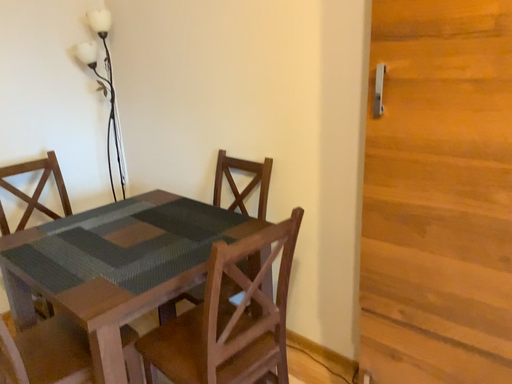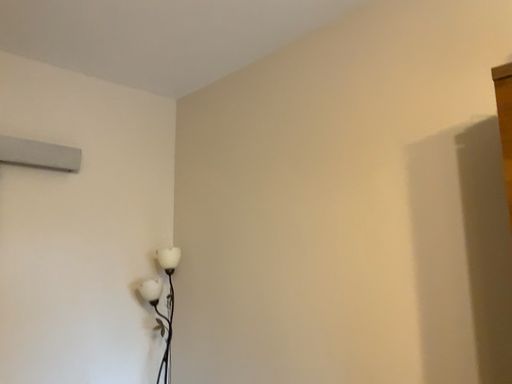
Question: Which way did the camera rotate in the video?

Choices:
 (A) rotated upward
 (B) rotated downward

Answer: (A)